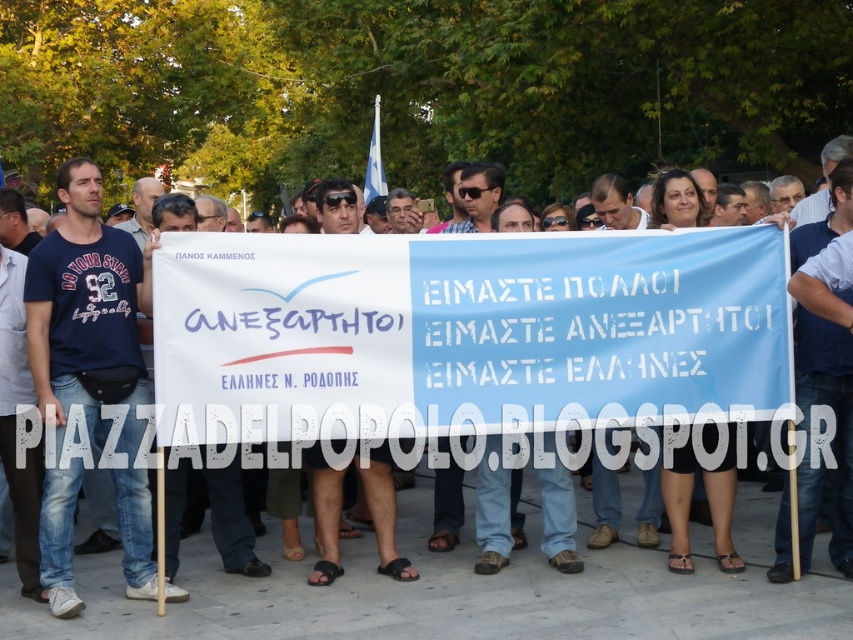
Question: Among these points, which one is nearest to the camera?

Choices:
 (A) click(840, 387)
 (B) click(527, 243)
 (C) click(102, 276)

Answer: (C)

Question: Where is white paper banner at center located in relation to matte blue t-shirt at center in the image?

Choices:
 (A) left
 (B) right

Answer: (B)

Question: Observing the image, what is the correct spatial positioning of matte blue t-shirt at center in reference to blue fabric flag at center?

Choices:
 (A) left
 (B) right

Answer: (A)

Question: Does white paper banner at center come in front of blue fabric flag at center?

Choices:
 (A) no
 (B) yes

Answer: (B)

Question: Among these points, which one is farthest from the camera?

Choices:
 (A) (119, 368)
 (B) (247, 288)
 (C) (851, 480)

Answer: (C)

Question: Which of these objects is positioned farthest from the matte blue t-shirt at center?

Choices:
 (A) white paper banner at center
 (B) blue fabric flag at center

Answer: (B)